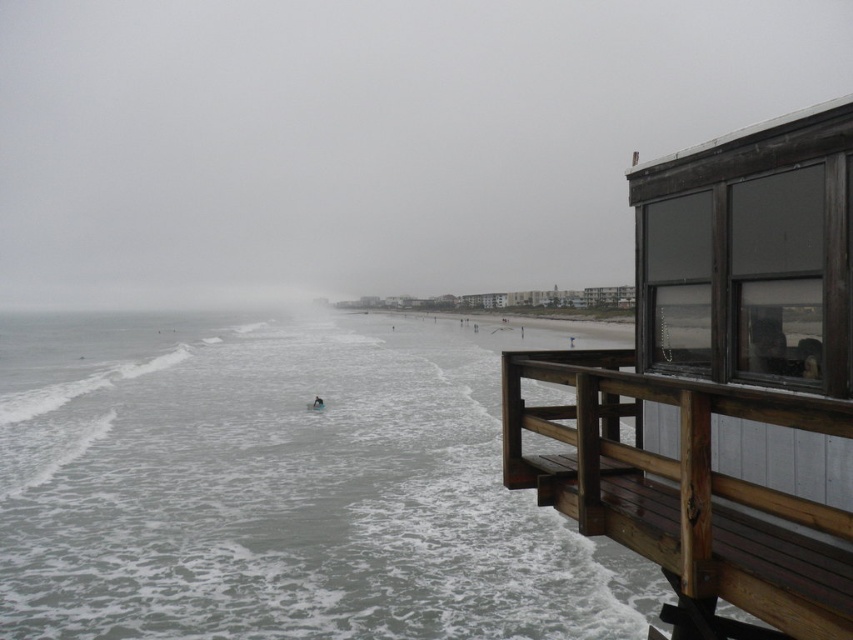
From the picture: You are standing on the wooden deck and want to watch the blue wetsuit surfer at center without moving. Is the brown wooden bench at right blocking your view of the surfer?

The brown wooden bench at right is positioned over the blue wetsuit surfer at center, so it is blocking your view of the surfer.

You are standing on the wooden deck and want to reach the blue wetsuit surfer at center. Which direction should you move to avoid the gray matte water at lower left?

You should move away from the gray matte water at lower left, which is positioned over the blue wetsuit surfer at center. To reach the surfer, move towards the center of the scene where the surfer is located, avoiding the water on the lower left.

You are standing on the wooden deck and want to sit down on the brown wooden bench at right or the blue wetsuit surfer at center. Which one is closer to you?

The brown wooden bench at right is closer to the viewer than the blue wetsuit surfer at center, so you should choose the brown wooden bench at right.